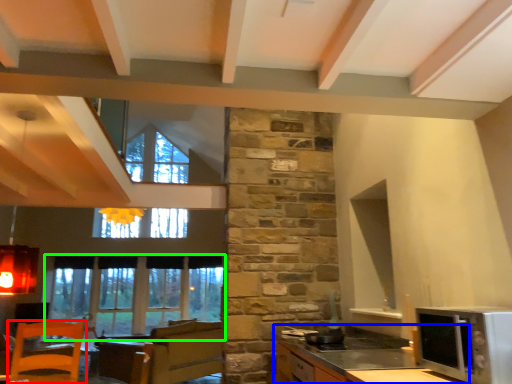
Question: Which is nearer to the chair (highlighted by a red box)? cabinetry (highlighted by a blue box) or window (highlighted by a green box).

Choices:
 (A) cabinetry
 (B) window

Answer: (B)